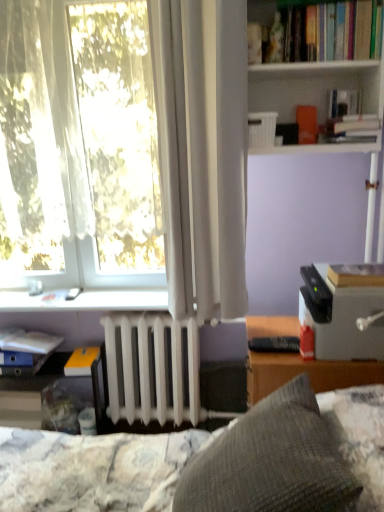
Question: Is white plastic window sill at lower left thinner than black plastic remote control at lower center?

Choices:
 (A) yes
 (B) no

Answer: (B)

Question: Is black plastic remote control at lower center surrounded by white plastic window sill at lower left?

Choices:
 (A) yes
 (B) no

Answer: (B)

Question: From a real-world perspective, is white plastic window sill at lower left positioned under black plastic remote control at lower center based on gravity?

Choices:
 (A) yes
 (B) no

Answer: (B)

Question: Is white plastic window sill at lower left outside black plastic remote control at lower center?

Choices:
 (A) no
 (B) yes

Answer: (B)

Question: Is white plastic window sill at lower left to the right of black plastic remote control at lower center from the viewer's perspective?

Choices:
 (A) no
 (B) yes

Answer: (A)

Question: Do you think black plastic remote control at lower center is within translucent plastic shelf at lower left, which appears as the second shelf when viewed from the front, or outside of it?

Choices:
 (A) outside
 (B) inside

Answer: (A)

Question: In terms of size, does black plastic remote control at lower center appear bigger or smaller than translucent plastic shelf at lower left, which is the first shelf in bottom-to-top order?

Choices:
 (A) small
 (B) big

Answer: (A)

Question: Considering their positions, is black plastic remote control at lower center located in front of or behind translucent plastic shelf at lower left, acting as the 1th shelf starting from the back?

Choices:
 (A) front
 (B) behind

Answer: (A)

Question: From the image's perspective, is black plastic remote control at lower center located above or below translucent plastic shelf at lower left, which appears as the second shelf when viewed from the front?

Choices:
 (A) below
 (B) above

Answer: (B)

Question: In terms of height, does hardcover book at upper center, which is counted as the 2th book, starting from the top, look taller or shorter compared to hardcover book at upper right, which appears as the second book when viewed from the front?

Choices:
 (A) tall
 (B) short

Answer: (A)

Question: From the image's perspective, is hardcover book at upper center, positioned as the third book in back-to-front order, positioned above or below hardcover book at upper right, the fourth book in the back-to-front sequence?

Choices:
 (A) below
 (B) above

Answer: (A)

Question: Considering the relative positions of hardcover book at upper center, arranged as the third book when viewed from the front, and hardcover book at upper right, the fourth book in the back-to-front sequence, in the image provided, is hardcover book at upper center, arranged as the third book when viewed from the front, to the left or to the right of hardcover book at upper right, the fourth book in the back-to-front sequence,?

Choices:
 (A) right
 (B) left

Answer: (A)

Question: From a real-world perspective, is hardcover book at upper center, the 5th book from the left, positioned above or below hardcover book at upper right, which is the 5th book in bottom-to-top order?

Choices:
 (A) above
 (B) below

Answer: (B)

Question: Considering the positions of white matte radiator at center and matte blue book at lower left, positioned as the 2th book in back-to-front order, in the image, is white matte radiator at center wider or thinner than matte blue book at lower left, positioned as the 2th book in back-to-front order,?

Choices:
 (A) thin
 (B) wide

Answer: (A)

Question: In terms of height, does white matte radiator at center look taller or shorter compared to matte blue book at lower left, arranged as the first book when viewed from the left?

Choices:
 (A) short
 (B) tall

Answer: (B)